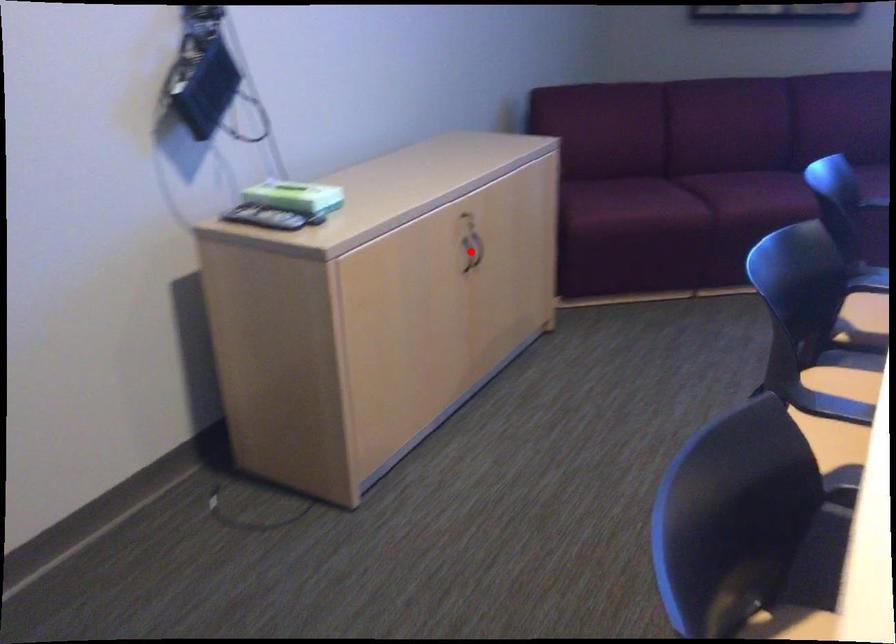
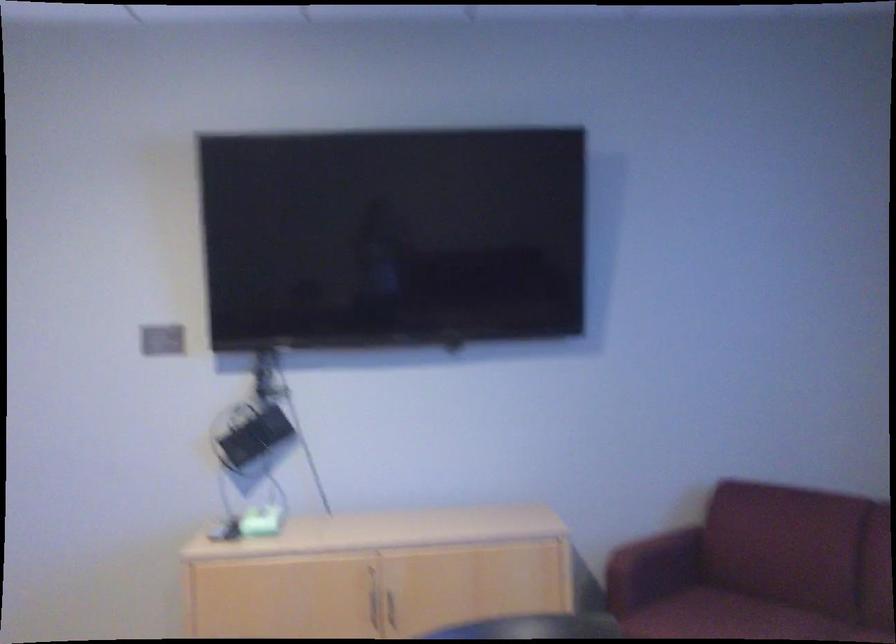
Where in the second image is the point corresponding to the highlighted location from the first image?

(374, 607)